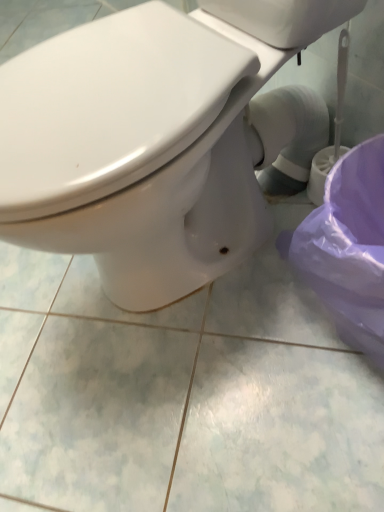
Locate an element on the screen. This screenshot has width=384, height=512. blank area to the left of purple plastic potty at lower right is located at coordinates (259, 337).